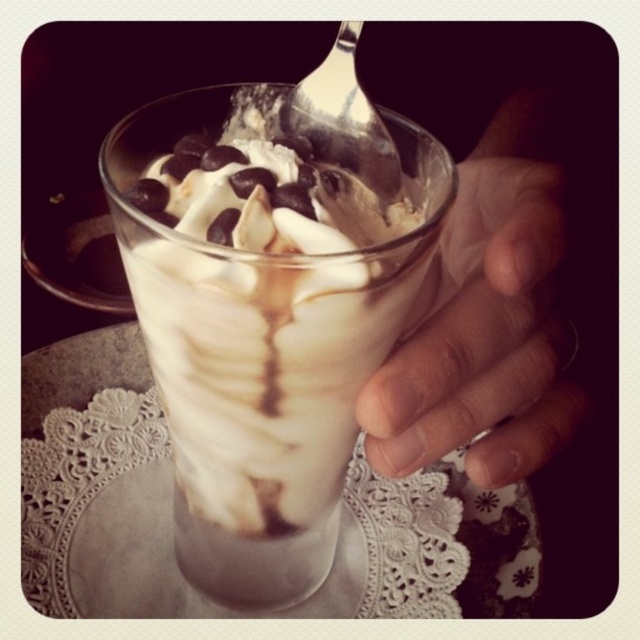
Question: Does smooth skin hand at right have a lesser width compared to silver metallic spoon at upper center?

Choices:
 (A) yes
 (B) no

Answer: (B)

Question: Can you confirm if smooth skin hand at right is thinner than silver metallic spoon at upper center?

Choices:
 (A) yes
 (B) no

Answer: (B)

Question: Is smooth skin hand at right bigger than silver metallic spoon at upper center?

Choices:
 (A) yes
 (B) no

Answer: (A)

Question: Among these points, which one is farthest from the camera?

Choices:
 (A) (509, 300)
 (B) (289, 97)

Answer: (B)